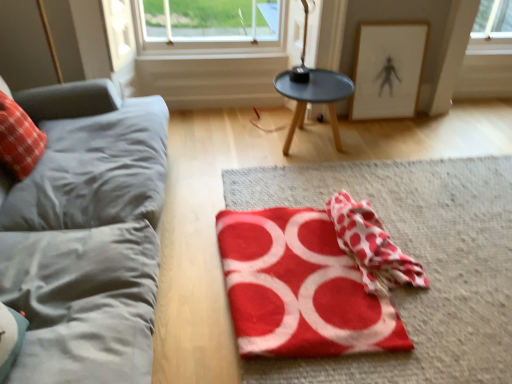
Find the location of a particular element. The image size is (512, 384). vacant space behind red felt yoga mat at center is located at coordinates (318, 184).